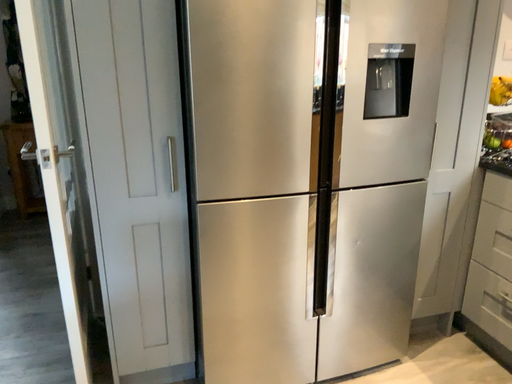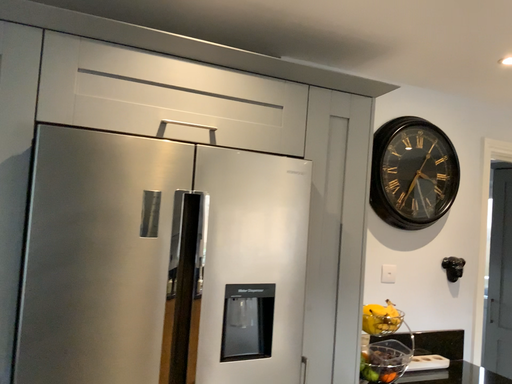
Question: Which way did the camera rotate in the video?

Choices:
 (A) rotated left
 (B) rotated right

Answer: (B)